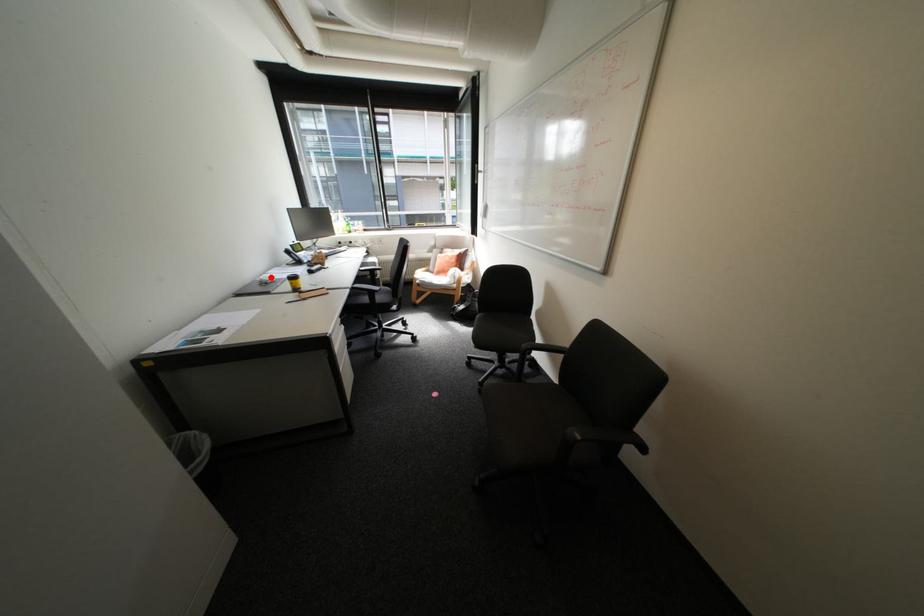
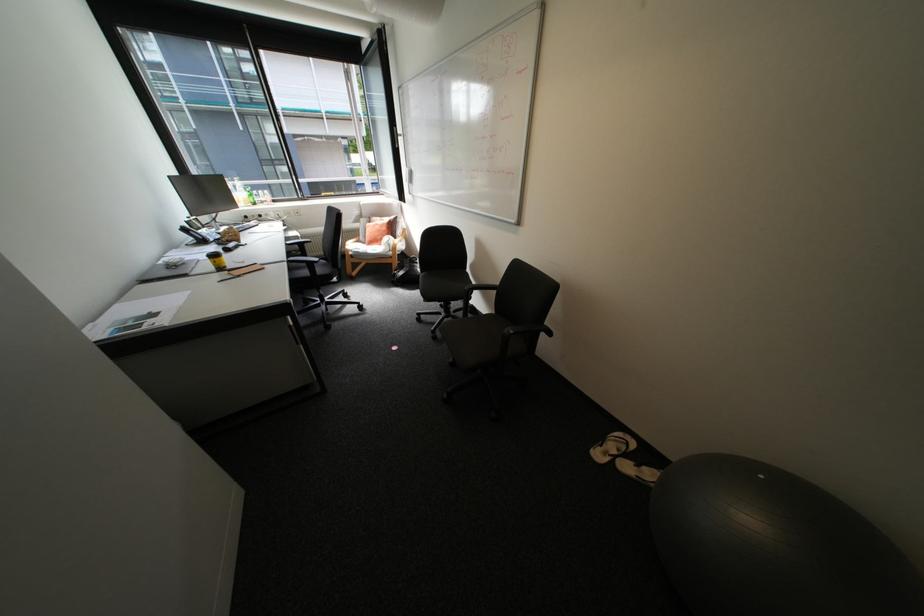
Locate, in the second image, the point that corresponds to the highlighted location in the first image.

(176, 260)